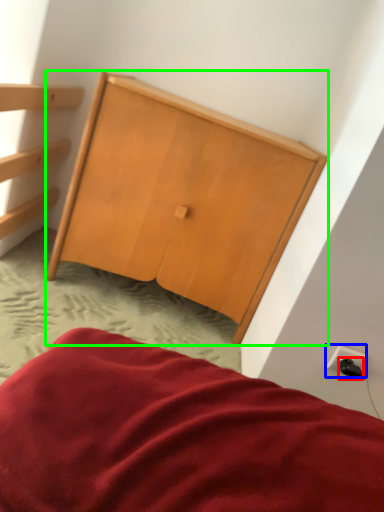
Question: Which object is the farthest from plug (highlighted by a red box)? Choose among these: electric outlet (highlighted by a blue box) or furniture (highlighted by a green box).

Choices:
 (A) electric outlet
 (B) furniture

Answer: (B)